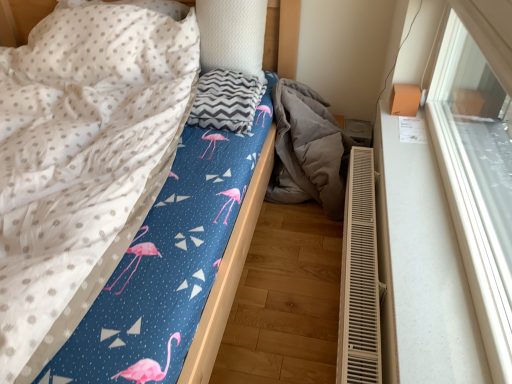
Where is `free space above white smooth window sill at right (from a real-world perspective)`? This screenshot has height=384, width=512. free space above white smooth window sill at right (from a real-world perspective) is located at coordinates (411, 195).